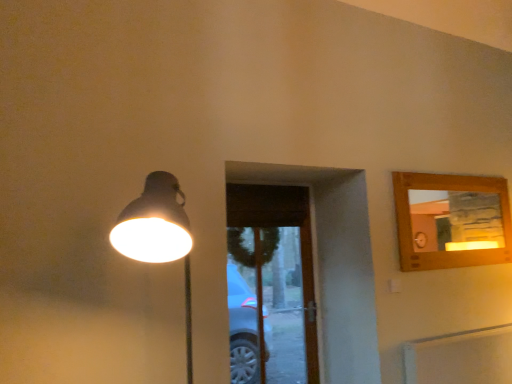
Describe the element at coordinates (274, 216) in the screenshot. I see `transparent glass door at center` at that location.

I want to click on transparent glass door at center, so click(274, 216).

What is the approximate height of matte black lamp at left?

matte black lamp at left is 1.01 meters in height.

The image size is (512, 384). What do you see at coordinates (158, 235) in the screenshot?
I see `matte black lamp at left` at bounding box center [158, 235].

Image resolution: width=512 pixels, height=384 pixels. Identify the location of matte black lamp at left. (158, 235).

Find the location of a particular element. transparent glass door at center is located at coordinates (274, 216).

Is matte black lamp at left to the right of transparent glass door at center from the viewer's perspective?

No.

Which object is closer to the camera taking this photo, matte black lamp at left or transparent glass door at center?

matte black lamp at left is in front.

Is point (160, 180) less distant than point (257, 189)?

Yes, it is in front of point (257, 189).

From the image's perspective, relative to transparent glass door at center, is matte black lamp at left above or below?

From the image's perspective, matte black lamp at left appears above transparent glass door at center.

From a real-world perspective, is matte black lamp at left positioned above or below transparent glass door at center?

matte black lamp at left is situated higher than transparent glass door at center in the real world.

Does matte black lamp at left have a greater width compared to transparent glass door at center?

Indeed, matte black lamp at left has a greater width compared to transparent glass door at center.

Considering the sizes of objects matte black lamp at left and transparent glass door at center in the image provided, who is shorter, matte black lamp at left or transparent glass door at center?

With less height is matte black lamp at left.

Considering the relative sizes of matte black lamp at left and transparent glass door at center in the image provided, is matte black lamp at left bigger than transparent glass door at center?

Yes, matte black lamp at left is bigger than transparent glass door at center.

Could transparent glass door at center be considered to be inside matte black lamp at left?

No, transparent glass door at center is not inside matte black lamp at left.

Is matte black lamp at left far away from transparent glass door at center?

That's right, there is a large distance between matte black lamp at left and transparent glass door at center.

Is matte black lamp at left oriented towards transparent glass door at center?

No, matte black lamp at left is not aimed at transparent glass door at center.

How different are the orientations of matte black lamp at left and transparent glass door at center in degrees?

The angular difference between matte black lamp at left and transparent glass door at center is 0.0583 degrees.

You are a GUI agent. You are given a task and a screenshot of the screen. Output one action in this format:
    pyautogui.click(x=<x>, y=<y>)
    Task: Click on the screen door below the matte black lamp at left (from the image's perspective)
    This screenshot has height=384, width=512.
    Given the screenshot: What is the action you would take?
    pyautogui.click(x=274, y=216)

Is transparent glass door at center at the right side of matte black lamp at left?

Indeed, transparent glass door at center is positioned on the right side of matte black lamp at left.

Is transparent glass door at center positioned in front of matte black lamp at left?

No, transparent glass door at center is further to the viewer.

Considering the positions of point (258, 188) and point (176, 254), is point (258, 188) closer or farther from the camera than point (176, 254)?

Point (258, 188) is positioned farther from the camera compared to point (176, 254).

From the image's perspective, between transparent glass door at center and matte black lamp at left, which one is located above?

matte black lamp at left, from the image's perspective.

From a real-world perspective, is transparent glass door at center located higher than matte black lamp at left?

No, from a real-world perspective, transparent glass door at center is not on top of matte black lamp at left.

Between transparent glass door at center and matte black lamp at left, which one has larger width?

Wider between the two is matte black lamp at left.

From their relative heights in the image, would you say transparent glass door at center is taller or shorter than matte black lamp at left?

transparent glass door at center is taller than matte black lamp at left.

Who is bigger, transparent glass door at center or matte black lamp at left?

matte black lamp at left is bigger.

Is matte black lamp at left inside transparent glass door at center?

No.

Is transparent glass door at center directly adjacent to matte black lamp at left?

transparent glass door at center and matte black lamp at left are clearly separated.

Is transparent glass door at center oriented away from matte black lamp at left?

No.

Measure the distance between transparent glass door at center and matte black lamp at left.

A distance of 1.41 meters exists between transparent glass door at center and matte black lamp at left.

In the image, there is a matte black lamp at left. What are the coordinates of `screen door below it (from a real-world perspective)` in the screenshot? It's located at (274, 216).

The image size is (512, 384). In order to click on screen door that is under the matte black lamp at left (from a real-world perspective) in this screenshot , I will do `click(274, 216)`.

What are the coordinates of `lamp positioned vertically above the transparent glass door at center (from a real-world perspective)` in the screenshot? It's located at (158, 235).